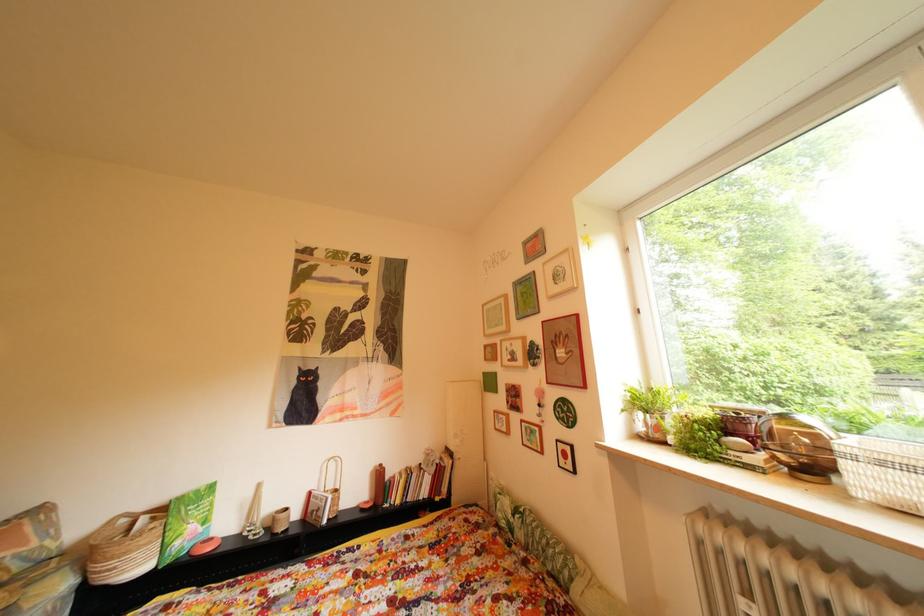
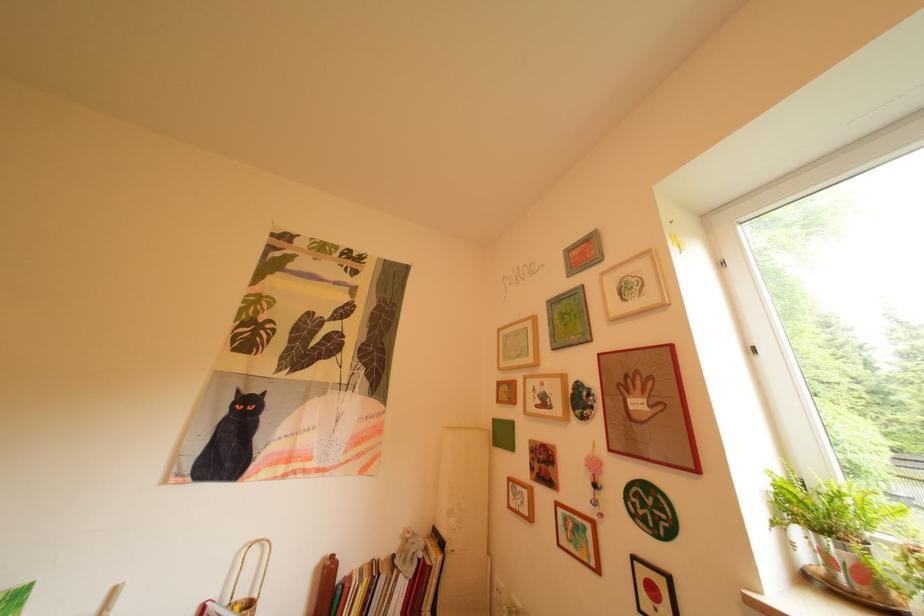
Question: What movement of the cameraman would produce the second image?

Choices:
 (A) Left
 (B) Right
 (C) Forward
 (D) Backward

Answer: (C)